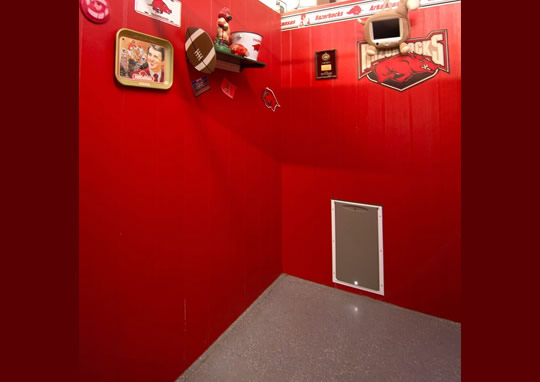
Locate an element on the screen. The height and width of the screenshot is (382, 540). wall art is located at coordinates (144, 63), (91, 12), (158, 9), (324, 63), (384, 61), (231, 85), (202, 85).